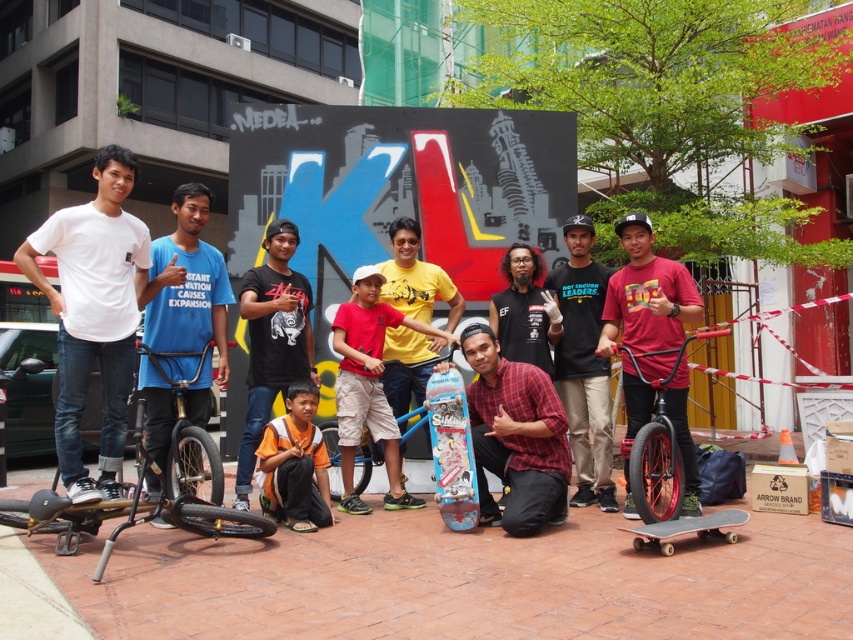
You are standing in front of the KL mural and want to place two stickers at the coordinates point (677, 396) and point (711, 513). Which sticker will be closer to your eyes?

The sticker placed at point (677, 396) will be closer to your eyes because it is closer to the viewer than point (711, 513).